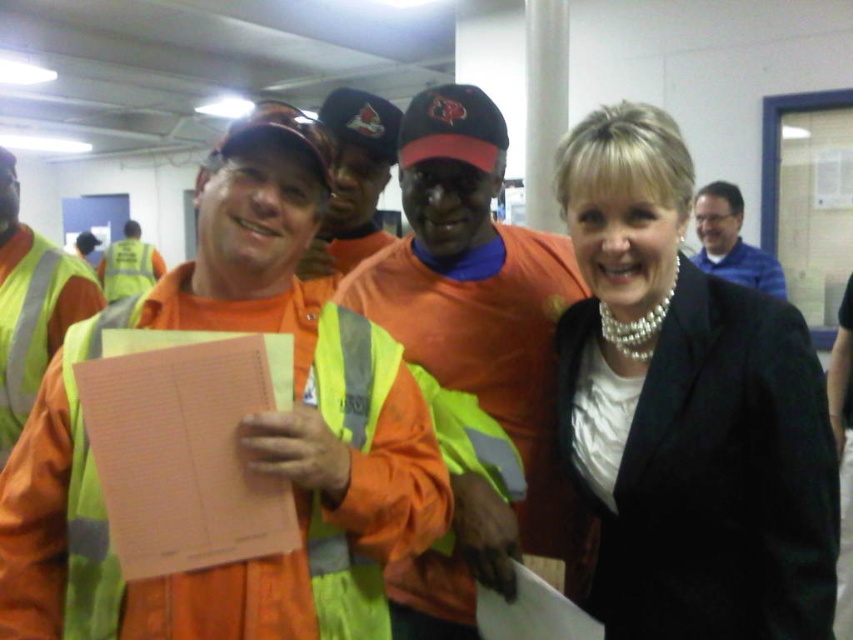
Question: Estimate the real-world distances between objects in this image. Which object is closer to the hi-viz reflective vest at center?

Choices:
 (A) blue shirt at upper right
 (B) pearl necklace at upper right
 (C) yellow reflective safety vest at left

Answer: (A)

Question: Does pearl necklace at upper right appear on the left side of hi-viz reflective vest at center?

Choices:
 (A) yes
 (B) no

Answer: (B)

Question: Can you confirm if orange reflective vest at left is bigger than hi-viz reflective vest at center?

Choices:
 (A) yes
 (B) no

Answer: (B)

Question: Is orange fabric shirt at center in front of blue shirt at upper right?

Choices:
 (A) no
 (B) yes

Answer: (B)

Question: Which point is farther to the camera?

Choices:
 (A) pearl necklace at upper right
 (B) orange fabric shirt at center
 (C) yellow reflective safety vest at left

Answer: (B)

Question: Which of the following is the farthest from the observer?

Choices:
 (A) (120, 282)
 (B) (128, 545)

Answer: (A)